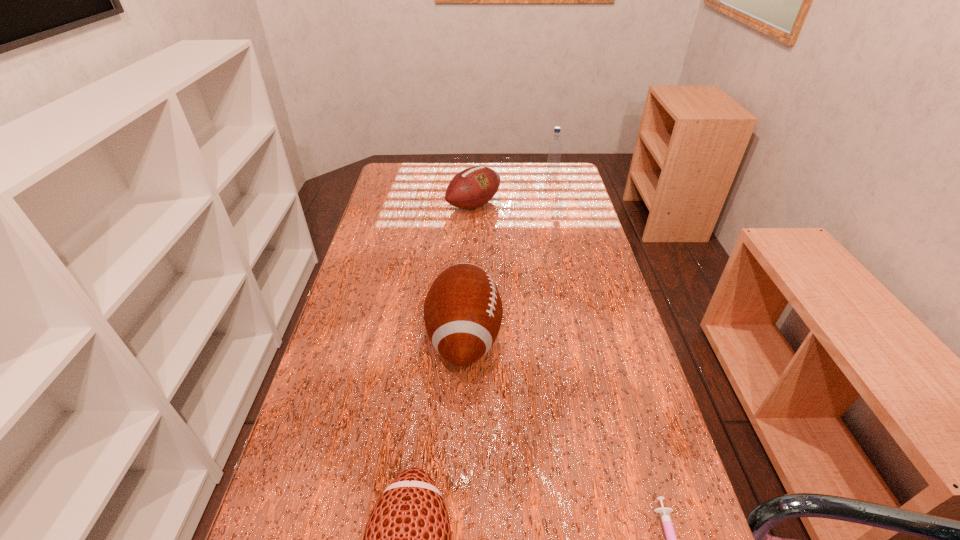
You are a GUI agent. You are given a task and a screenshot of the screen. Output one action in this format:
    pyautogui.click(x=<x>, y=<y>)
    Task: Click on the object that is the closest to the rightmost object
    Image resolution: width=960 pixels, height=540 pixels.
    Given the screenshot: What is the action you would take?
    pyautogui.click(x=463, y=310)

You are a GUI agent. You are given a task and a screenshot of the screen. Output one action in this format:
    pyautogui.click(x=<x>, y=<y>)
    Task: Click on the closest football to the farthest football
    Image resolution: width=960 pixels, height=540 pixels.
    Given the screenshot: What is the action you would take?
    pyautogui.click(x=463, y=310)

Where is `football that is the closest to the nearest football`? The image size is (960, 540). football that is the closest to the nearest football is located at coordinates (463, 310).

Where is `vacant space that satisfies the following two spatial constraints: 1. on the front side of the farthest football; 2. on the laces of the third nearest object`? This screenshot has width=960, height=540. vacant space that satisfies the following two spatial constraints: 1. on the front side of the farthest football; 2. on the laces of the third nearest object is located at coordinates pyautogui.click(x=471, y=338).